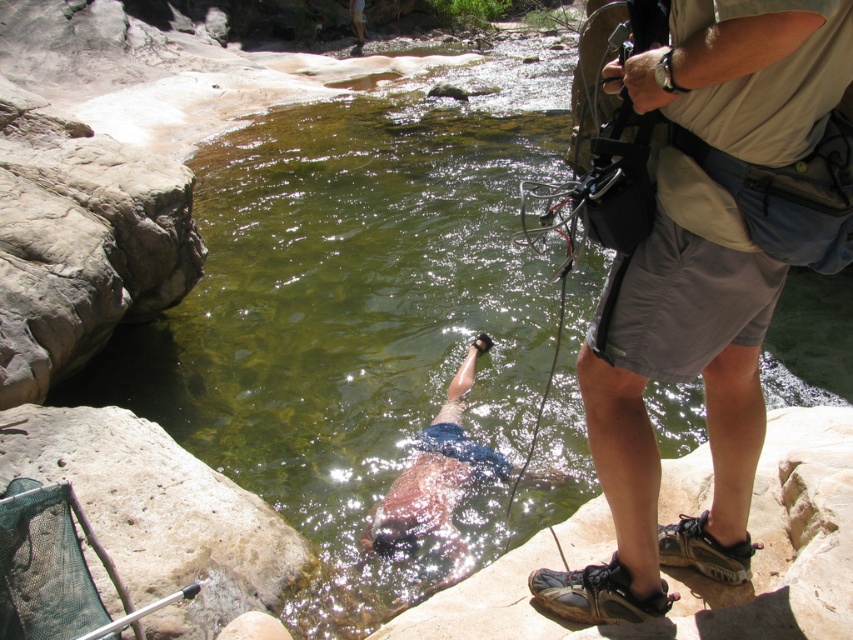
You are standing at the edge of the river and want to place a small pebble at point 1 and another at point 2. Which point is closer to you? Please answer with point followed by coordinates. The points are point (560,632) and point (151,625).

Point (560,632) is closer to you than point (151,625).

You are standing at the edge of the river and want to step onto the brown rock at lower center and the smooth beige rock at lower left. Which rock should you step on first if you want to move from left to right across the riverbed?

You should step on the smooth beige rock at lower left first because the brown rock at lower center is positioned to its right side, so moving from left to right would require starting with the smooth beige rock at lower left.